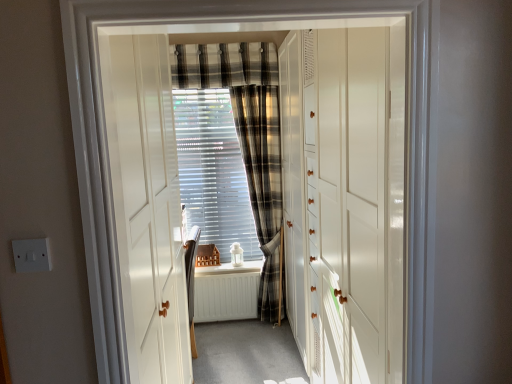
Where is `free location to the right of white matte radiator at center`? Image resolution: width=512 pixels, height=384 pixels. free location to the right of white matte radiator at center is located at coordinates (260, 334).